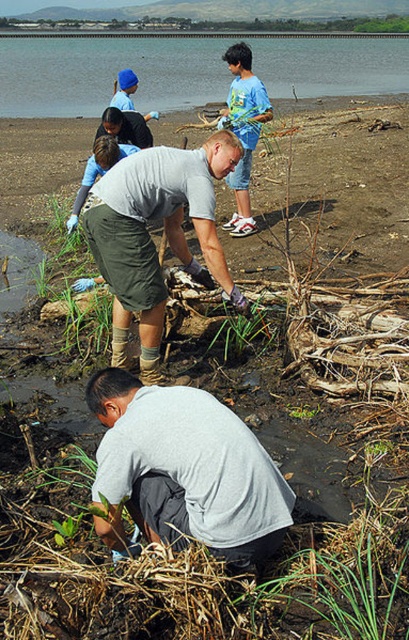
You are a photographer trying to capture a closeup shot of the gray matte shorts at center and the blue cotton shirt at upper center. Which object would require you to move closer to the subject to get a clear image?

The gray matte shorts at center occupies less space in the frame than the blue cotton shirt at upper center, so you would need to move closer to the gray matte shorts at center to capture it in a clear closeup.